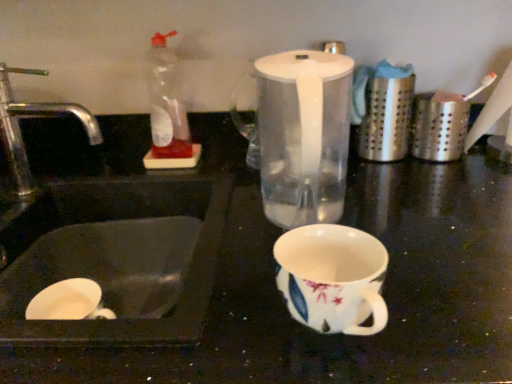
Question: Does transparent plastic blender at center turn towards silver metallic faucet at left?

Choices:
 (A) no
 (B) yes

Answer: (A)

Question: Is transparent plastic blender at center located outside silver metallic faucet at left?

Choices:
 (A) yes
 (B) no

Answer: (A)

Question: Does transparent plastic blender at center appear on the left side of silver metallic faucet at left?

Choices:
 (A) yes
 (B) no

Answer: (B)

Question: Considering the relative positions of transparent plastic blender at center and silver metallic faucet at left in the image provided, is transparent plastic blender at center to the right of silver metallic faucet at left from the viewer's perspective?

Choices:
 (A) yes
 (B) no

Answer: (A)

Question: Is transparent plastic blender at center touching silver metallic faucet at left?

Choices:
 (A) yes
 (B) no

Answer: (B)

Question: Would you say silver metallic faucet at left is to the left or to the right of white glossy sink at lower left in the picture?

Choices:
 (A) right
 (B) left

Answer: (B)

Question: From a real-world perspective, is silver metallic faucet at left physically located above or below white glossy sink at lower left?

Choices:
 (A) below
 (B) above

Answer: (B)

Question: In the image, is silver metallic faucet at left positioned in front of or behind white glossy sink at lower left?

Choices:
 (A) front
 (B) behind

Answer: (B)

Question: Is point (4, 117) closer or farther from the camera than point (40, 162)?

Choices:
 (A) farther
 (B) closer

Answer: (B)

Question: Looking at their shapes, would you say silver metallic faucet at left is wider or thinner than transparent plastic blender at center?

Choices:
 (A) wide
 (B) thin

Answer: (B)

Question: Considering their positions, is silver metallic faucet at left located in front of or behind transparent plastic blender at center?

Choices:
 (A) front
 (B) behind

Answer: (B)

Question: Looking at the image, does silver metallic faucet at left seem bigger or smaller compared to transparent plastic blender at center?

Choices:
 (A) small
 (B) big

Answer: (A)

Question: From the image's perspective, is silver metallic faucet at left located above or below transparent plastic blender at center?

Choices:
 (A) below
 (B) above

Answer: (B)

Question: From a real-world perspective, is transparent plastic blender at center positioned above or below white glossy sink at lower left?

Choices:
 (A) below
 (B) above

Answer: (B)

Question: Based on their sizes in the image, would you say transparent plastic blender at center is bigger or smaller than white glossy sink at lower left?

Choices:
 (A) small
 (B) big

Answer: (A)